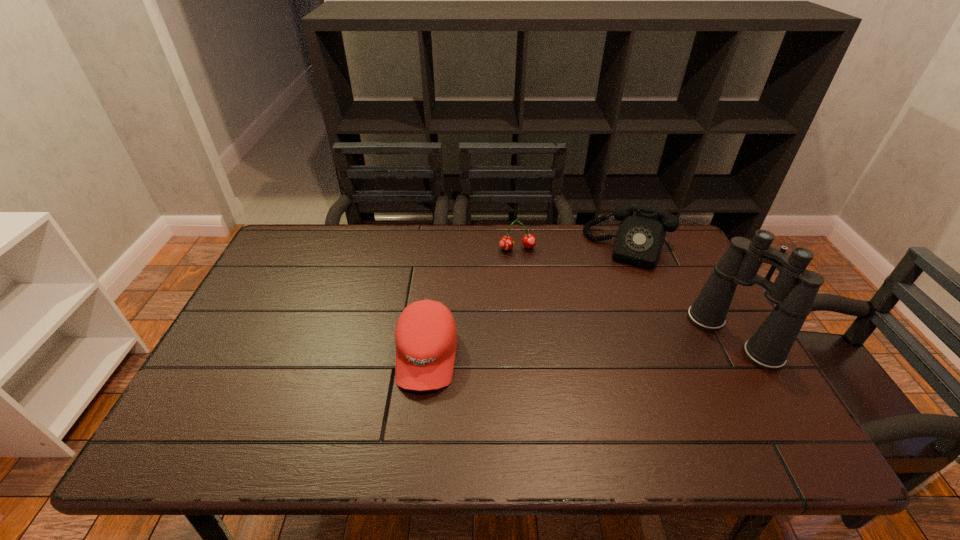
Image resolution: width=960 pixels, height=540 pixels. In order to click on cap in this screenshot , I will do `click(426, 334)`.

Identify the location of binoculars. The width and height of the screenshot is (960, 540). (793, 292).

Where is `telephone`? This screenshot has height=540, width=960. telephone is located at coordinates (640, 237).

This screenshot has width=960, height=540. Identify the location of cherry. (506, 243).

Where is `vacant space located 0.260m on the left of the tallest object`? vacant space located 0.260m on the left of the tallest object is located at coordinates (597, 337).

Where is `vacant space located on the dial of the telephone`? The height and width of the screenshot is (540, 960). vacant space located on the dial of the telephone is located at coordinates (604, 321).

Image resolution: width=960 pixels, height=540 pixels. Identify the location of free space located 0.220m on the dial of the telephone. (605, 316).

The width and height of the screenshot is (960, 540). What are the coordinates of `vacant space located on the dial of the telephone` in the screenshot? It's located at (590, 361).

Locate an element on the screen. free space located 0.320m with stems pointing upwards on the second object from left to right is located at coordinates (541, 328).

You are a GUI agent. You are given a task and a screenshot of the screen. Output one action in this format:
    pyautogui.click(x=<x>, y=<y>)
    Task: Click on the free location located with stems pointing upwards on the second object from left to right
    This screenshot has width=960, height=540.
    Given the screenshot: What is the action you would take?
    pyautogui.click(x=540, y=323)